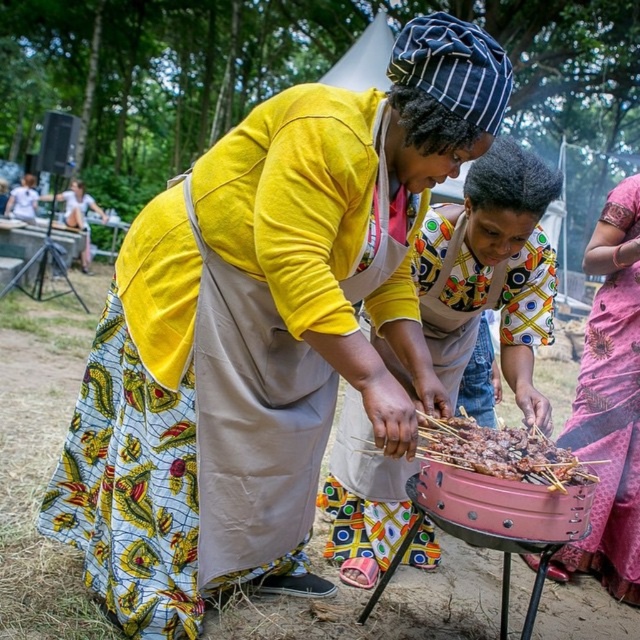
Who is more distant from viewer, [381,474] or [461,436]?

Point [381,474]

Does printed fabric shirt at center appear under brown charred skewers at center?

No, printed fabric shirt at center is not below brown charred skewers at center.

You are a GUI agent. You are given a task and a screenshot of the screen. Output one action in this format:
    pyautogui.click(x=<x>, y=<y>)
    Task: Click on the printed fabric shirt at center
    
    Given the screenshot: What is the action you would take?
    pyautogui.click(x=490, y=280)

Is pink fabric dress at right closer to the viewer compared to brown charred skewers at center?

No, pink fabric dress at right is behind brown charred skewers at center.

Which of these two, pink fabric dress at right or brown charred skewers at center, stands taller?

With more height is pink fabric dress at right.

Identify the location of pink fabric dress at right. The height and width of the screenshot is (640, 640). (609, 403).

Between printed fabric shirt at center and pink fabric dress at right, which one has more height?

Standing taller between the two is pink fabric dress at right.

Does printed fabric shirt at center have a larger size compared to pink fabric dress at right?

Indeed, printed fabric shirt at center has a larger size compared to pink fabric dress at right.

Image resolution: width=640 pixels, height=640 pixels. Describe the element at coordinates (490, 280) in the screenshot. I see `printed fabric shirt at center` at that location.

This screenshot has width=640, height=640. Find the location of `printed fabric shirt at center`. printed fabric shirt at center is located at coordinates (490, 280).